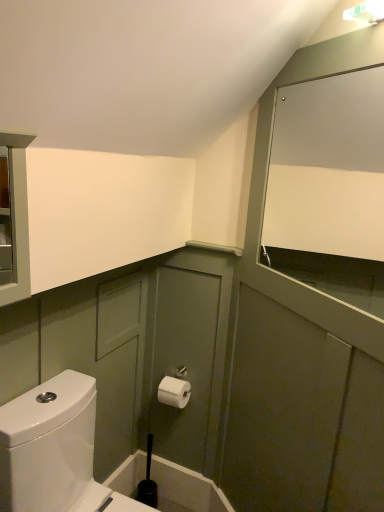
Question: Is white glossy toilet at lower left surrounded by white paper toilet paper at center?

Choices:
 (A) no
 (B) yes

Answer: (A)

Question: Does white paper toilet paper at center have a greater height compared to white glossy toilet at lower left?

Choices:
 (A) no
 (B) yes

Answer: (A)

Question: From the image's perspective, does white paper toilet paper at center appear lower than white glossy toilet at lower left?

Choices:
 (A) yes
 (B) no

Answer: (B)

Question: Considering the relative positions of white paper toilet paper at center and white glossy toilet at lower left in the image provided, is white paper toilet paper at center to the left of white glossy toilet at lower left from the viewer's perspective?

Choices:
 (A) yes
 (B) no

Answer: (B)

Question: Does white paper toilet paper at center appear on the right side of white glossy toilet at lower left?

Choices:
 (A) no
 (B) yes

Answer: (B)

Question: Is white paper toilet paper at center outside of white glossy toilet at lower left?

Choices:
 (A) yes
 (B) no

Answer: (A)

Question: Is black plastic toilet brush at lower center shorter than white matte cabinet at upper right?

Choices:
 (A) yes
 (B) no

Answer: (A)

Question: Is white matte cabinet at upper right inside black plastic toilet brush at lower center?

Choices:
 (A) yes
 (B) no

Answer: (B)

Question: Are black plastic toilet brush at lower center and white matte cabinet at upper right making contact?

Choices:
 (A) no
 (B) yes

Answer: (A)

Question: Is black plastic toilet brush at lower center at the right side of white matte cabinet at upper right?

Choices:
 (A) no
 (B) yes

Answer: (A)

Question: Considering the relative sizes of black plastic toilet brush at lower center and white matte cabinet at upper right in the image provided, is black plastic toilet brush at lower center wider than white matte cabinet at upper right?

Choices:
 (A) yes
 (B) no

Answer: (B)

Question: From the image's perspective, does black plastic toilet brush at lower center appear higher than white matte cabinet at upper right?

Choices:
 (A) no
 (B) yes

Answer: (A)

Question: Does white glossy toilet at lower left touch white paper toilet paper at center?

Choices:
 (A) yes
 (B) no

Answer: (B)